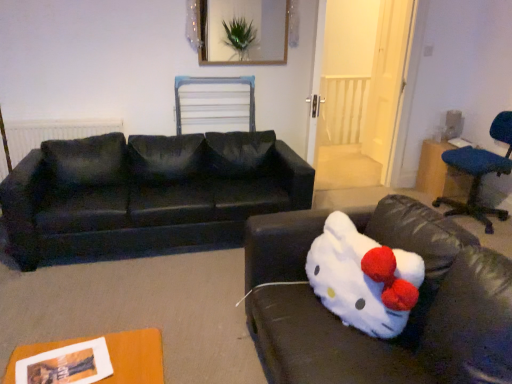
Where is `free space in front of blue fabric table at right`? The width and height of the screenshot is (512, 384). free space in front of blue fabric table at right is located at coordinates (464, 208).